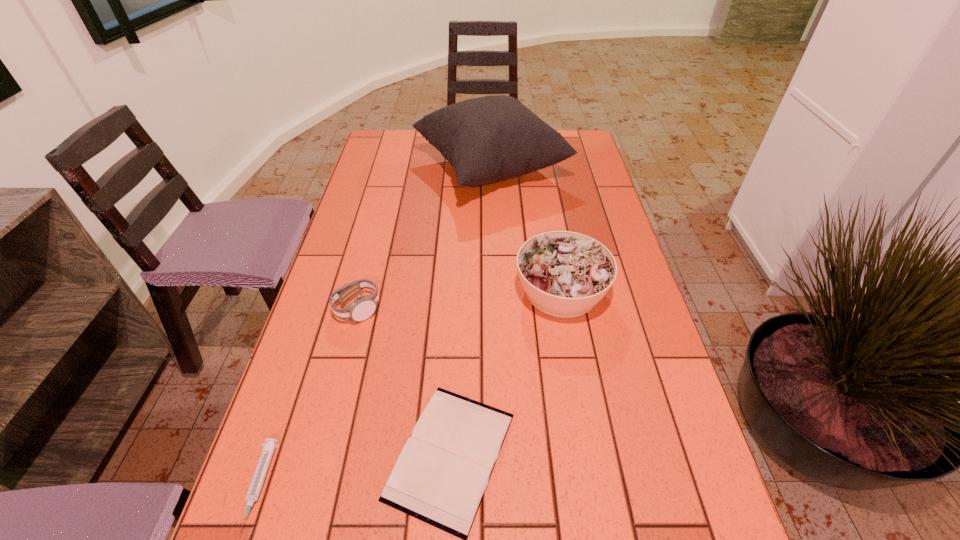
Image resolution: width=960 pixels, height=540 pixels. I want to click on vacant space that is in between the salad and the leftmost object, so click(x=410, y=389).

Locate an element on the screen. Image resolution: width=960 pixels, height=540 pixels. free space that is in between the second object from left to right and the tallest object is located at coordinates coord(424,239).

Where is `vacant area that lies between the leftmost object and the tallest object`? vacant area that lies between the leftmost object and the tallest object is located at coordinates (374, 328).

Identify the location of free space between the cushion and the second object from left to right. The image size is (960, 540). click(424, 239).

Image resolution: width=960 pixels, height=540 pixels. In order to click on free spot between the tallest object and the watch in this screenshot , I will do 424,239.

What are the coordinates of `object that is the second closest to the leftmost object` in the screenshot? It's located at (363, 307).

Locate an element on the screen. This screenshot has height=540, width=960. object that stands as the closest to the second tallest object is located at coordinates (440, 477).

What are the coordinates of `free location that satisfies the following two spatial constraints: 1. on the face of the second object from left to right; 2. at the needle end of the syringe` in the screenshot? It's located at (311, 487).

At what (x,y) coordinates should I click in order to perform the action: click on free region that satisfies the following two spatial constraints: 1. on the face of the watch; 2. at the needle end of the leftmost object. Please return your answer as a coordinate pair (x, y). The image size is (960, 540). Looking at the image, I should click on (311, 487).

Locate an element on the screen. Image resolution: width=960 pixels, height=540 pixels. free spot that satisfies the following two spatial constraints: 1. on the front side of the tallest object; 2. on the left side of the fourth shortest object is located at coordinates (494, 291).